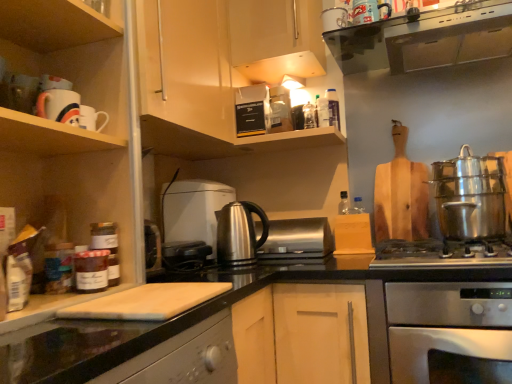
This screenshot has height=384, width=512. What are the coordinates of `matte wood cabinet at upper center, arranged as the first cabinetry when viewed from the back` in the screenshot? It's located at (276, 38).

Measure the distance between metallic silver toaster at upper center, the 2th appliance when ordered from front to back, and camera.

They are 5.56 feet apart.

This screenshot has width=512, height=384. Describe the element at coordinates (239, 233) in the screenshot. I see `stainless steel kettle at center, the 2th kitchen appliance from the back` at that location.

Identify the location of wooden cutting board at upper left, the third cabinetry when ordered from back to front. (70, 126).

The width and height of the screenshot is (512, 384). I want to click on matte wood cabinet at upper center, arranged as the first cabinetry when viewed from the back, so click(276, 38).

Image resolution: width=512 pixels, height=384 pixels. Identify the location of the 2nd cabinetry located above the satin silver toaster at center, the first appliance in the bottom-to-top sequence (from a real-world perspective). (220, 71).

Does satin silver toaster at center, the second appliance viewed from the top, have a lesser height compared to matte wood cabinet at upper center, positioned as the 2th cabinetry in back-to-front order?

Indeed, satin silver toaster at center, the second appliance viewed from the top, has a lesser height compared to matte wood cabinet at upper center, positioned as the 2th cabinetry in back-to-front order.

Is satin silver toaster at center, the first appliance in the bottom-to-top sequence, placed right next to matte wood cabinet at upper center, positioned as the 2th cabinetry in back-to-front order?

No, satin silver toaster at center, the first appliance in the bottom-to-top sequence, is not making contact with matte wood cabinet at upper center, positioned as the 2th cabinetry in back-to-front order.

From a real-world perspective, is satin silver toaster at center, the second appliance viewed from the top, above or below matte wood cabinet at upper center, the 2th cabinetry viewed from the front?

In terms of real-world spatial position, satin silver toaster at center, the second appliance viewed from the top, is below matte wood cabinet at upper center, the 2th cabinetry viewed from the front.

Locate an element on the screen. bottle on the left of stainless steel oven at lower right is located at coordinates (333, 108).

From the picture: From the image's perspective, is stainless steel oven at lower right above clear plastic bottle at upper center?

No, from the image's perspective, stainless steel oven at lower right is not on top of clear plastic bottle at upper center.

Would you consider stainless steel oven at lower right to be distant from clear plastic bottle at upper center?

stainless steel oven at lower right is near clear plastic bottle at upper center, not far away.

Considering the sizes of stainless steel oven at lower right and clear plastic bottle at upper center in the image, is stainless steel oven at lower right taller or shorter than clear plastic bottle at upper center?

stainless steel oven at lower right is taller than clear plastic bottle at upper center.

Considering the relative positions of stainless steel kettle at center, the 2th kitchen appliance from the back, and clear plastic bottle at upper center in the image provided, is stainless steel kettle at center, the 2th kitchen appliance from the back, in front of clear plastic bottle at upper center?

Yes, it is in front of clear plastic bottle at upper center.

You are a GUI agent. You are given a task and a screenshot of the screen. Output one action in this format:
    pyautogui.click(x=<x>, y=<y>)
    Task: Click on the bottle behind the stainless steel kettle at center, the 1th kitchen appliance positioned from the front
    This screenshot has width=512, height=384.
    Given the screenshot: What is the action you would take?
    (x=333, y=108)

Would you consider stainless steel kettle at center, the 1th kitchen appliance positioned from the front, to be distant from clear plastic bottle at upper center?

stainless steel kettle at center, the 1th kitchen appliance positioned from the front, is near clear plastic bottle at upper center, not far away.

Is stainless steel kettle at center, the 1th kitchen appliance positioned from the front, inside the boundaries of clear plastic bottle at upper center, or outside?

stainless steel kettle at center, the 1th kitchen appliance positioned from the front, is spatially situated outside clear plastic bottle at upper center.

This screenshot has height=384, width=512. In order to click on gas stove lying on the right of clear plastic bottle at upper center in this screenshot , I will do `click(441, 254)`.

Is clear plastic bottle at upper center wider than stainless steel gas stove at lower right?

No, clear plastic bottle at upper center is not wider than stainless steel gas stove at lower right.

Would you consider clear plastic bottle at upper center to be distant from stainless steel gas stove at lower right?

That's not correct — clear plastic bottle at upper center is a little close to stainless steel gas stove at lower right.

Is matte wood cabinet at upper center, arranged as the first cabinetry when viewed from the back, inside stainless steel gas stove at lower right?

No.

Is stainless steel gas stove at lower right to the left of matte wood cabinet at upper center, which is counted as the third cabinetry, starting from the front, from the viewer's perspective?

Incorrect, stainless steel gas stove at lower right is not on the left side of matte wood cabinet at upper center, which is counted as the third cabinetry, starting from the front.

From a real-world perspective, relative to matte wood cabinet at upper center, which is counted as the third cabinetry, starting from the front, is stainless steel gas stove at lower right vertically above or below?

stainless steel gas stove at lower right is situated lower than matte wood cabinet at upper center, which is counted as the third cabinetry, starting from the front, in the real world.

In the scene shown: Considering the sizes of stainless steel oven at lower right and stainless steel gas stove at lower right in the image, is stainless steel oven at lower right wider or thinner than stainless steel gas stove at lower right?

A: Clearly, stainless steel oven at lower right has more width compared to stainless steel gas stove at lower right.

Is stainless steel gas stove at lower right at the back of stainless steel oven at lower right?

No, stainless steel gas stove at lower right is not at the back of stainless steel oven at lower right.

Is point (394, 333) more distant than point (397, 250)?

No, (394, 333) is closer to viewer.

Which object is further away from the camera, stainless steel oven at lower right or stainless steel gas stove at lower right?

stainless steel gas stove at lower right is further from the camera.

From a real-world perspective, starting from the clear plastic bottle at upper center, which cabinetry is the 2nd one vertically above it? Please provide its 2D coordinates.

[(276, 38)]

From a real-world perspective, which is physically below, matte wood cabinet at upper center, arranged as the first cabinetry when viewed from the back, or clear plastic bottle at upper center?

clear plastic bottle at upper center is physically lower.

Is matte wood cabinet at upper center, arranged as the first cabinetry when viewed from the back, bigger than clear plastic bottle at upper center?

Yes.

From the image's perspective, is matte wood cabinet at upper center, which is counted as the third cabinetry, starting from the front, above or below clear plastic bottle at upper center?

Answer: Clearly, from the image's perspective, matte wood cabinet at upper center, which is counted as the third cabinetry, starting from the front, is above clear plastic bottle at upper center.

There is a satin silver toaster at center, which is the 1th appliance in front-to-back order. At what (x,y) coordinates should I click in order to perform the action: click on the 2nd cabinetry above it (from a real-world perspective). Please return your answer as a coordinate pair (x, y). Image resolution: width=512 pixels, height=384 pixels. Looking at the image, I should click on (220, 71).

Locate an element on the screen. The height and width of the screenshot is (384, 512). oven below the clear plastic bottle at upper center (from a real-world perspective) is located at coordinates (446, 324).

Based on their spatial positions, is stainless steel kettle at center, the 2th kitchen appliance from the back, or black granite countertop at center further from black glass range hood at upper center?

black granite countertop at center lies further to black glass range hood at upper center than the other object.

From the image, which object appears to be farther from metallic silver toaster at upper center, the 1th appliance when ordered from top to bottom, matte wood cabinet at upper center, arranged as the first cabinetry when viewed from the back, or clear plastic bottle at upper center?

matte wood cabinet at upper center, arranged as the first cabinetry when viewed from the back, lies further to metallic silver toaster at upper center, the 1th appliance when ordered from top to bottom, than the other object.

From the image, which object appears to be farther from wooden cutting board at upper left, the third cabinetry when ordered from back to front, metallic silver toaster at upper center, the 1th appliance when ordered from top to bottom, or metallic stainless steel kettle at center, positioned as the 1th kitchen appliance in back-to-front order?

metallic silver toaster at upper center, the 1th appliance when ordered from top to bottom, is positioned further to the anchor wooden cutting board at upper left, the third cabinetry when ordered from back to front.

Estimate the real-world distances between objects in this image. Which object is closer to satin silver toaster at center, arranged as the second appliance when viewed from the back, metallic stainless steel kettle at center, which appears as the second kitchen appliance when viewed from the front, or black granite countertop at center?

Based on the image, metallic stainless steel kettle at center, which appears as the second kitchen appliance when viewed from the front, appears to be nearer to satin silver toaster at center, arranged as the second appliance when viewed from the back.

From the image, which object appears to be farther from metallic silver toaster at upper center, the 2th appliance when ordered from front to back, clear plastic bottle at upper center or black glass range hood at upper center?

black glass range hood at upper center is positioned further to the anchor metallic silver toaster at upper center, the 2th appliance when ordered from front to back.

Which object lies further to the anchor point black glass range hood at upper center, clear plastic bottle at upper center or matte wood cabinet at upper center, positioned as the 2th cabinetry in back-to-front order?

matte wood cabinet at upper center, positioned as the 2th cabinetry in back-to-front order, is further to black glass range hood at upper center.

Which object lies further to the anchor point stainless steel kettle at center, the 2th kitchen appliance from the back, matte wood cabinet at upper center, arranged as the first cabinetry when viewed from the back, or clear plastic bottle at upper center?

matte wood cabinet at upper center, arranged as the first cabinetry when viewed from the back, is positioned further to the anchor stainless steel kettle at center, the 2th kitchen appliance from the back.

When comparing their distances from matte wood cabinet at upper center, which is counted as the third cabinetry, starting from the front, does black glass range hood at upper center or wooden cutting board at upper left, the third cabinetry when ordered from back to front, seem closer?

black glass range hood at upper center.

You are a GUI agent. You are given a task and a screenshot of the screen. Output one action in this format:
    pyautogui.click(x=<x>, y=<y>)
    Task: Click on the countertop situated between wooden cutting board at upper left, acting as the first cabinetry starting from the front, and stainless steel oven at lower right from left to right
    
    Given the screenshot: What is the action you would take?
    pyautogui.click(x=179, y=318)

Where is `appliance between matte wood cabinet at upper center, arranged as the first cabinetry when viewed from the back, and metallic stainless steel kettle at center, positioned as the 1th kitchen appliance in back-to-front order, from top to bottom`? appliance between matte wood cabinet at upper center, arranged as the first cabinetry when viewed from the back, and metallic stainless steel kettle at center, positioned as the 1th kitchen appliance in back-to-front order, from top to bottom is located at coordinates (280, 110).

Locate an element on the screen. appliance between wooden cutting board at upper left, acting as the first cabinetry starting from the front, and metallic stainless steel kettle at center, which appears as the second kitchen appliance when viewed from the front, from front to back is located at coordinates (297, 239).

Where is `home appliance between matte wood cabinet at upper center, arranged as the first cabinetry when viewed from the back, and black granite countertop at center from top to bottom`? Image resolution: width=512 pixels, height=384 pixels. home appliance between matte wood cabinet at upper center, arranged as the first cabinetry when viewed from the back, and black granite countertop at center from top to bottom is located at coordinates (424, 40).